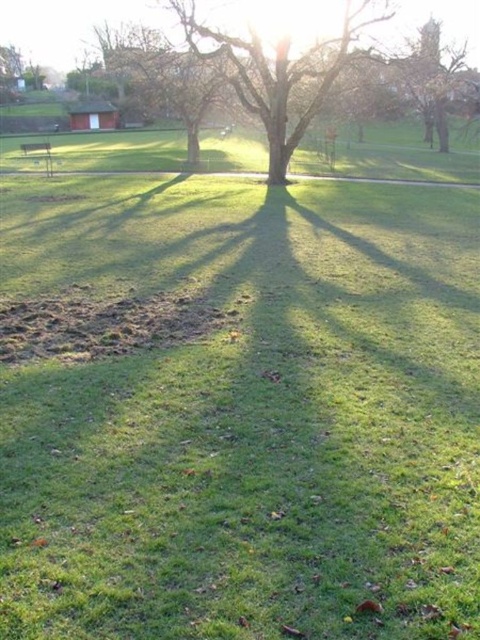
Question: Is smooth brown tree at center closer to camera compared to brown wood tree at upper right?

Choices:
 (A) yes
 (B) no

Answer: (A)

Question: Is smooth brown tree at center wider than brown wood tree at upper right?

Choices:
 (A) no
 (B) yes

Answer: (A)

Question: Can you confirm if smooth brown tree at center is positioned to the left of brown wood tree at upper right?

Choices:
 (A) no
 (B) yes

Answer: (B)

Question: Among these objects, which one is farthest from the camera?

Choices:
 (A) brown wood tree at upper right
 (B) smooth brown tree at center

Answer: (A)